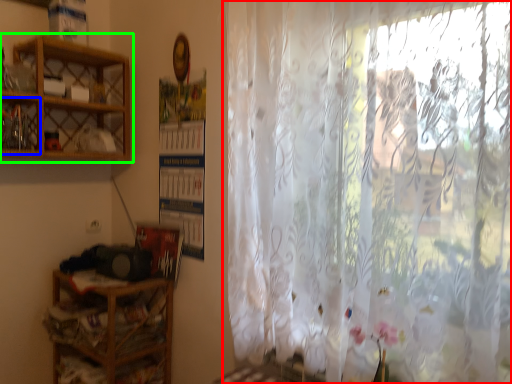
Question: Estimate the real-world distances between objects in this image. Which object is farther from curtain (highlighted by a red box), cabinet (highlighted by a blue box) or shelf (highlighted by a green box)?

Choices:
 (A) cabinet
 (B) shelf

Answer: (A)